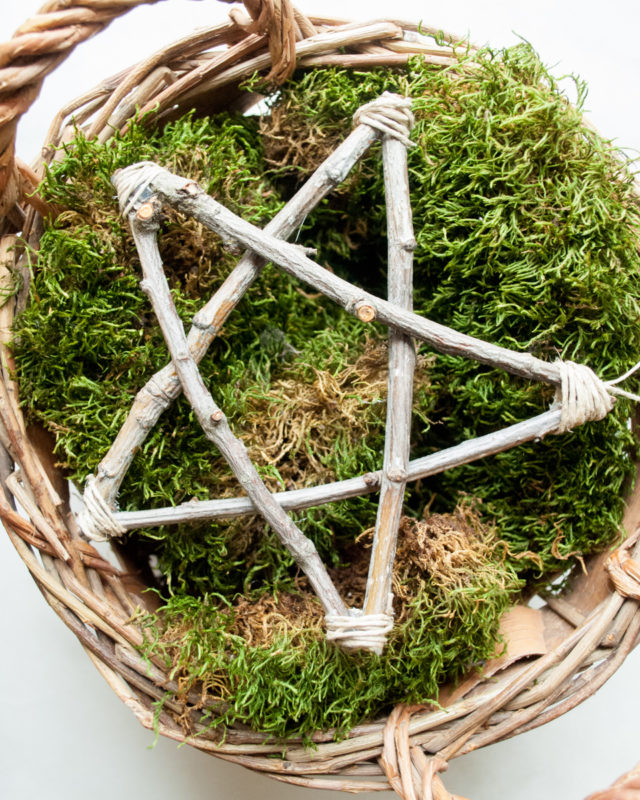
Where is `left handle of basket`? Image resolution: width=640 pixels, height=800 pixels. left handle of basket is located at coordinates (45, 45).